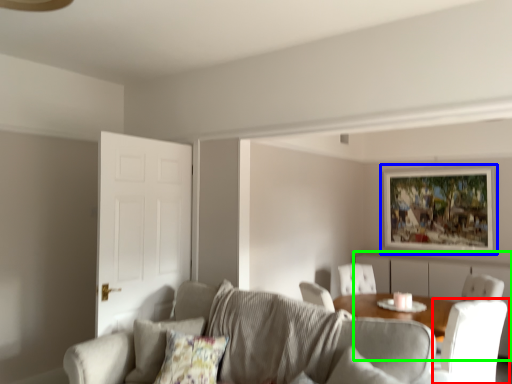
Question: Based on their relative distances, which object is farther from chair (highlighted by a red box)? Choose from picture frame (highlighted by a blue box) and dresser (highlighted by a green box).

Choices:
 (A) picture frame
 (B) dresser

Answer: (A)